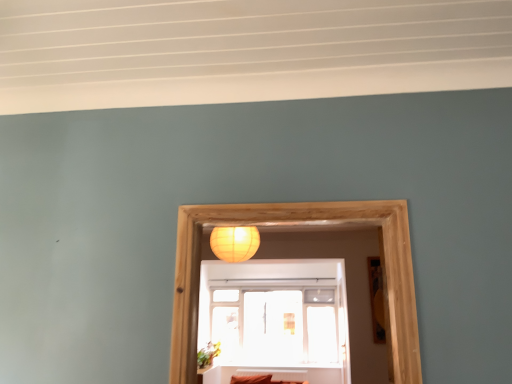
Question: Should I look upward or downward to see matte yellow paper lantern at upper center?

Choices:
 (A) up
 (B) down

Answer: (B)

Question: Is matte yellow paper lantern at upper center thinner than wooden picture frame at right?

Choices:
 (A) no
 (B) yes

Answer: (A)

Question: From a real-world perspective, is matte yellow paper lantern at upper center located higher than wooden picture frame at right?

Choices:
 (A) yes
 (B) no

Answer: (A)

Question: Is matte yellow paper lantern at upper center closer to the viewer compared to wooden picture frame at right?

Choices:
 (A) no
 (B) yes

Answer: (B)

Question: Is wooden picture frame at right at the back of matte yellow paper lantern at upper center?

Choices:
 (A) no
 (B) yes

Answer: (A)

Question: Would you consider matte yellow paper lantern at upper center to be distant from wooden picture frame at right?

Choices:
 (A) yes
 (B) no

Answer: (A)

Question: Is wooden picture frame at right inside matte yellow paper lantern at upper center?

Choices:
 (A) no
 (B) yes

Answer: (A)

Question: From the image's perspective, would you say transparent glass window at center is positioned over matte yellow paper lantern at upper center?

Choices:
 (A) no
 (B) yes

Answer: (A)

Question: Is matte yellow paper lantern at upper center at the back of transparent glass window at center?

Choices:
 (A) yes
 (B) no

Answer: (B)

Question: Is transparent glass window at center facing towards matte yellow paper lantern at upper center?

Choices:
 (A) yes
 (B) no

Answer: (A)

Question: Is transparent glass window at center placed right next to matte yellow paper lantern at upper center?

Choices:
 (A) yes
 (B) no

Answer: (B)

Question: Is transparent glass window at center wider than matte yellow paper lantern at upper center?

Choices:
 (A) no
 (B) yes

Answer: (A)

Question: Does transparent glass window at center have a greater height compared to matte yellow paper lantern at upper center?

Choices:
 (A) yes
 (B) no

Answer: (A)

Question: Is wooden picture frame at right positioned beyond the bounds of transparent glass window at center?

Choices:
 (A) no
 (B) yes

Answer: (B)